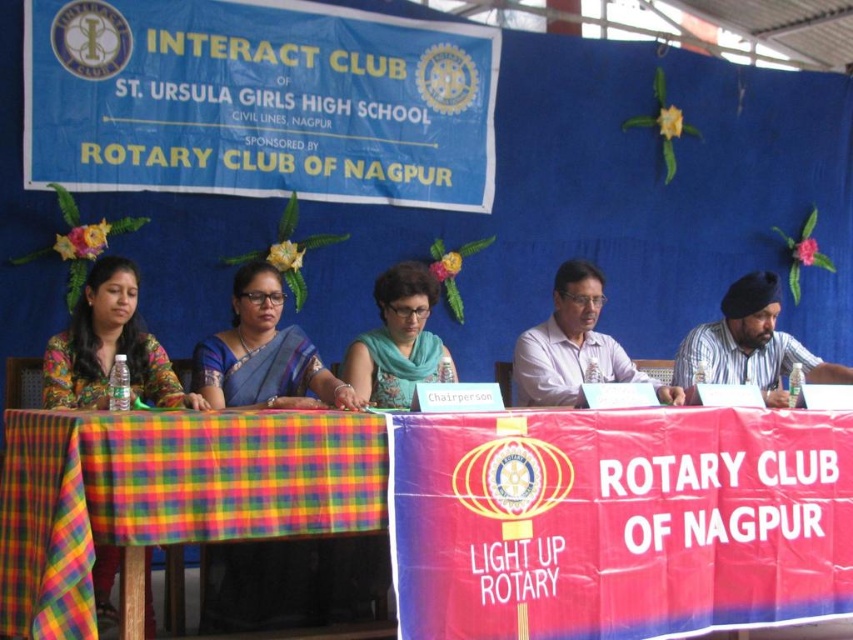
You are a photographer at the event and want to capture a photo of the plaid fabric tablecloth at center and the striped shirt at right. Which object is taller in the image?

The plaid fabric tablecloth at center is taller than the striped shirt at right.